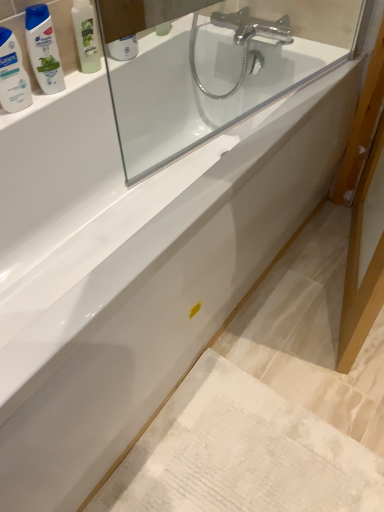
Question: From the image's perspective, relative to white glossy bottle at upper left, is transparent glass mirror at upper center above or below?

Choices:
 (A) below
 (B) above

Answer: (B)

Question: Considering the positions of transparent glass mirror at upper center and white glossy bottle at upper left in the image, is transparent glass mirror at upper center bigger or smaller than white glossy bottle at upper left?

Choices:
 (A) big
 (B) small

Answer: (A)

Question: Which is farther from the green plastic mouthwash at upper left?

Choices:
 (A) white textured bath mat at lower right
 (B) white glossy bottle at upper left
 (C) transparent glass mirror at upper center
 (D) green matte shampoo bottle at upper left

Answer: (A)

Question: Which object is the closest to the transparent glass mirror at upper center?

Choices:
 (A) white textured bath mat at lower right
 (B) white glossy bottle at upper left
 (C) green plastic mouthwash at upper left
 (D) green matte shampoo bottle at upper left

Answer: (D)